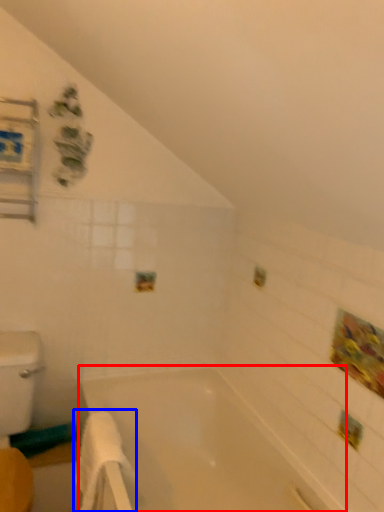
Question: Which of the following is the farthest to the observer, bathtub (highlighted by a red box) or bath towel (highlighted by a blue box)?

Choices:
 (A) bathtub
 (B) bath towel

Answer: (B)